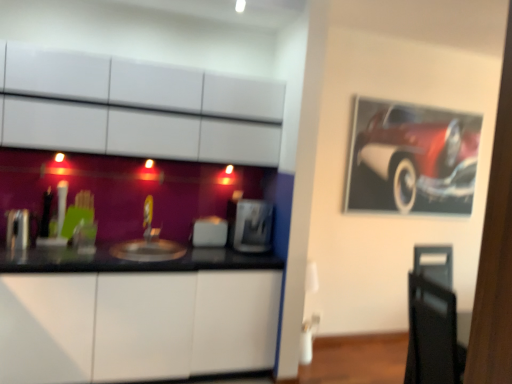
Question: From the image's perspective, is satin silver toaster at left, the 3th appliance when ordered from right to left, beneath white glossy cabinets at upper center, the 2th cabinetry in the bottom-to-top sequence?

Choices:
 (A) yes
 (B) no

Answer: (A)

Question: Is satin silver toaster at left, the first appliance from the front, to the left of white glossy cabinets at upper center, the 2th cabinetry in the bottom-to-top sequence, from the viewer's perspective?

Choices:
 (A) yes
 (B) no

Answer: (A)

Question: Is the position of satin silver toaster at left, the 3th appliance when ordered from right to left, more distant than that of white glossy cabinets at upper center, which ranks as the first cabinetry in top-to-bottom order?

Choices:
 (A) yes
 (B) no

Answer: (A)

Question: Can white glossy cabinets at upper center, the 2th cabinetry in the bottom-to-top sequence, be found inside satin silver toaster at left, the 3th appliance when ordered from right to left?

Choices:
 (A) no
 (B) yes

Answer: (A)

Question: Is satin silver toaster at left, the first appliance from the front, thinner than white glossy cabinets at upper center, the 2th cabinetry in the bottom-to-top sequence?

Choices:
 (A) yes
 (B) no

Answer: (A)

Question: From a real-world perspective, is white glossy cabinets at upper center, the 2th cabinetry in the bottom-to-top sequence, physically located above or below satin silver toaster at center, which appears as the 2th appliance when viewed from the front?

Choices:
 (A) below
 (B) above

Answer: (B)

Question: From the image's perspective, is white glossy cabinets at upper center, which ranks as the first cabinetry in top-to-bottom order, positioned above or below satin silver toaster at center, which appears as the 2th appliance when viewed from the front?

Choices:
 (A) above
 (B) below

Answer: (A)

Question: In terms of height, does white glossy cabinets at upper center, which ranks as the first cabinetry in top-to-bottom order, look taller or shorter compared to satin silver toaster at center, which ranks as the first appliance in right-to-left order?

Choices:
 (A) tall
 (B) short

Answer: (A)

Question: Does point pyautogui.click(x=54, y=142) appear closer or farther from the camera than point pyautogui.click(x=267, y=231)?

Choices:
 (A) closer
 (B) farther

Answer: (A)

Question: Considering the positions of satin silver toaster at center, which appears as the 2th appliance when viewed from the front, and satin silver toaster at center, which appears as the third appliance when viewed from the front, in the image, is satin silver toaster at center, which appears as the 2th appliance when viewed from the front, bigger or smaller than satin silver toaster at center, which appears as the third appliance when viewed from the front,?

Choices:
 (A) big
 (B) small

Answer: (A)

Question: From the image's perspective, is satin silver toaster at center, the second appliance positioned from the back, above or below satin silver toaster at center, the second appliance when ordered from right to left?

Choices:
 (A) above
 (B) below

Answer: (A)

Question: Relative to satin silver toaster at center, which appears as the third appliance when viewed from the front, is satin silver toaster at center, the second appliance positioned from the back, in front or behind?

Choices:
 (A) behind
 (B) front

Answer: (B)

Question: From a real-world perspective, is satin silver toaster at center, which ranks as the 3th appliance in left-to-right order, positioned above or below satin silver toaster at center, placed as the 1th appliance when sorted from back to front?

Choices:
 (A) above
 (B) below

Answer: (A)

Question: Is matte silver sink at center bigger or smaller than white glossy cabinet at lower left, which is the 1th cabinetry from bottom to top?

Choices:
 (A) small
 (B) big

Answer: (A)

Question: From a real-world perspective, relative to white glossy cabinet at lower left, which is the 1th cabinetry from bottom to top, is matte silver sink at center vertically above or below?

Choices:
 (A) below
 (B) above

Answer: (B)